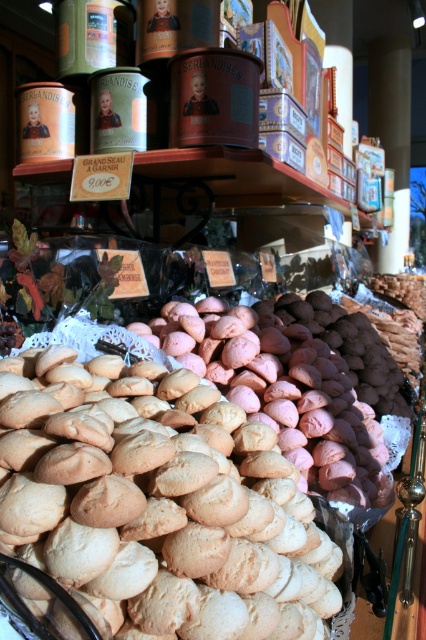
Can you confirm if golden brown cookie at center is smaller than golden matte cookies at center?

Indeed, golden brown cookie at center has a smaller size compared to golden matte cookies at center.

Does golden brown cookie at center appear on the right side of golden matte cookies at center?

In fact, golden brown cookie at center is to the left of golden matte cookies at center.

Is point (204, 621) closer to viewer compared to point (138, 323)?

That is True.

At what (x,y) coordinates should I click in order to perform the action: click on golden brown cookie at center. Please return your answer as a coordinate pair (x, y). The width and height of the screenshot is (426, 640). Looking at the image, I should click on (166, 515).